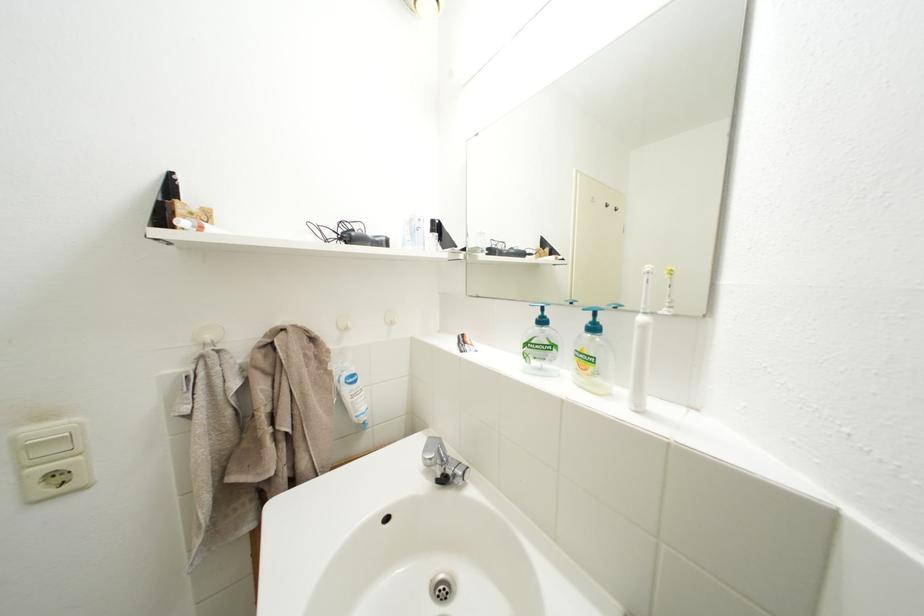
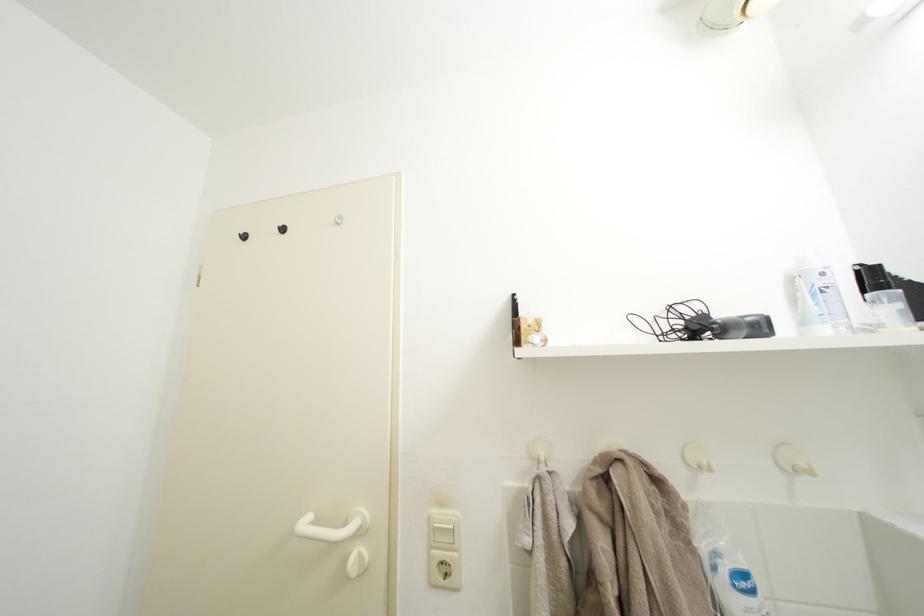
In the second image, find the point that corresponds to (429,225) in the first image.

(833, 280)